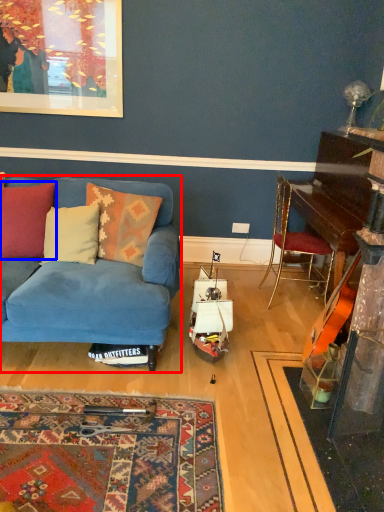
Question: Among these objects, which one is farthest to the camera, studio couch (highlighted by a red box) or pillow (highlighted by a blue box)?

Choices:
 (A) studio couch
 (B) pillow

Answer: (B)